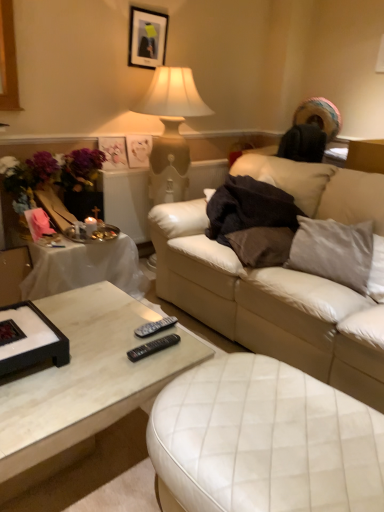
Question: Does matte plastic picture frame at upper left, which appears as the 1th picture frame when ordered from the bottom, have a lesser height compared to vibrant silk bouquet at left?

Choices:
 (A) no
 (B) yes

Answer: (B)

Question: Is matte plastic picture frame at upper left, the 3th picture frame when ordered from top to bottom, looking in the opposite direction of vibrant silk bouquet at left?

Choices:
 (A) yes
 (B) no

Answer: (B)

Question: Does matte plastic picture frame at upper left, which appears as the 1th picture frame when ordered from the bottom, come in front of vibrant silk bouquet at left?

Choices:
 (A) no
 (B) yes

Answer: (A)

Question: Can you confirm if matte plastic picture frame at upper left, the 3th picture frame when ordered from top to bottom, is taller than vibrant silk bouquet at left?

Choices:
 (A) yes
 (B) no

Answer: (B)

Question: Is matte plastic picture frame at upper left, the 3th picture frame when ordered from top to bottom, at the right side of vibrant silk bouquet at left?

Choices:
 (A) no
 (B) yes

Answer: (B)

Question: From a real-world perspective, does matte plastic picture frame at upper left, the 3th picture frame when ordered from top to bottom, stand above vibrant silk bouquet at left?

Choices:
 (A) no
 (B) yes

Answer: (B)

Question: Is matte white picture frame at upper center, the second picture frame in the bottom-to-top sequence, a part of satin gray pillow at right?

Choices:
 (A) yes
 (B) no

Answer: (B)

Question: Considering the relative sizes of satin gray pillow at right and matte white picture frame at upper center, the second picture frame in the bottom-to-top sequence, in the image provided, is satin gray pillow at right taller than matte white picture frame at upper center, the second picture frame in the bottom-to-top sequence,?

Choices:
 (A) no
 (B) yes

Answer: (B)

Question: Does satin gray pillow at right have a greater width compared to matte white picture frame at upper center, the 2th picture frame when ordered from top to bottom?

Choices:
 (A) no
 (B) yes

Answer: (B)

Question: From a real-world perspective, is satin gray pillow at right physically below matte white picture frame at upper center, the 2th picture frame when ordered from top to bottom?

Choices:
 (A) yes
 (B) no

Answer: (A)

Question: Is satin gray pillow at right at the right side of matte white picture frame at upper center, the 2th picture frame when ordered from top to bottom?

Choices:
 (A) no
 (B) yes

Answer: (B)

Question: Is satin gray pillow at right next to matte white picture frame at upper center, the second picture frame in the bottom-to-top sequence?

Choices:
 (A) yes
 (B) no

Answer: (B)

Question: Is matte white picture frame at upper center, the 2th picture frame when ordered from top to bottom, far away from white leather ottoman at center?

Choices:
 (A) no
 (B) yes

Answer: (B)